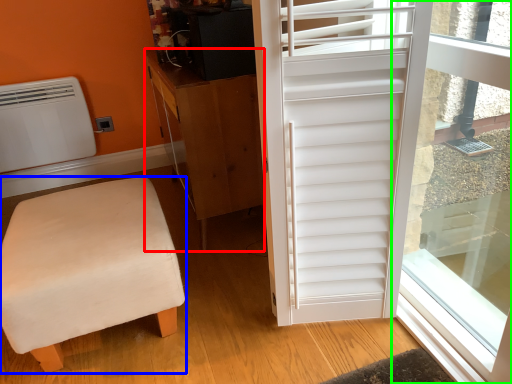
Question: Which object is the farthest from cabinetry (highlighted by a red box)? Choose among these: furniture (highlighted by a blue box) or window screen (highlighted by a green box).

Choices:
 (A) furniture
 (B) window screen

Answer: (B)